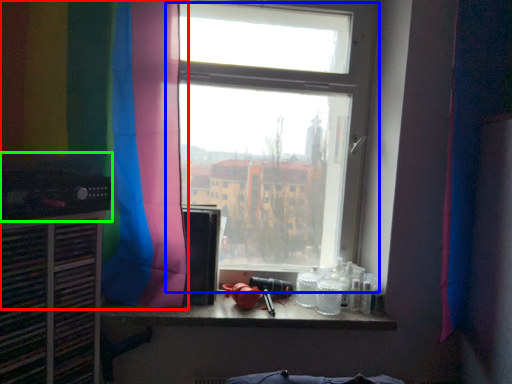
Question: Which object is positioned closest to curtain (highlighted by a red box)? Select from window (highlighted by a blue box) and appliance (highlighted by a green box).

Choices:
 (A) window
 (B) appliance

Answer: (B)